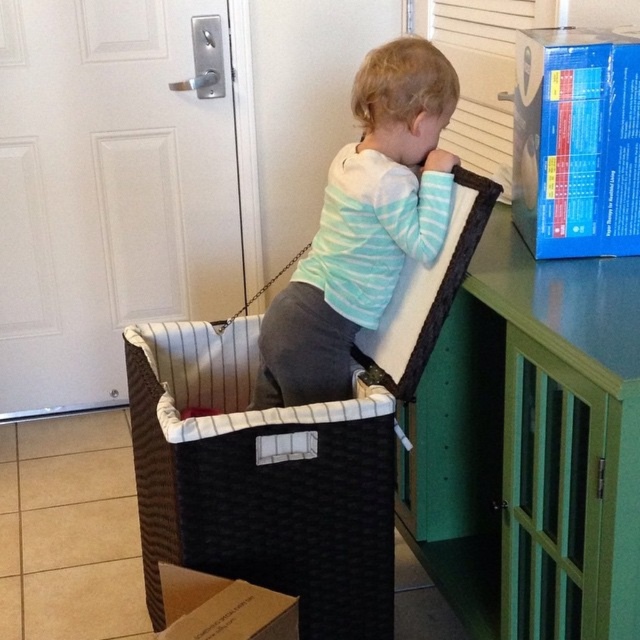
Does blue cardboard box at upper right have a greater height compared to cardboard at lower left?

Indeed, blue cardboard box at upper right has a greater height compared to cardboard at lower left.

This screenshot has width=640, height=640. I want to click on blue cardboard box at upper right, so click(x=577, y=141).

From the picture: Who is more distant from viewer, (604, 180) or (291, 612)?

The point (604, 180) is more distant.

Locate an element on the screen. blue cardboard box at upper right is located at coordinates (577, 141).

Find the location of a particular element. The image size is (640, 640). light blue striped shirt at upper center is located at coordinates click(x=364, y=225).

Can you confirm if light blue striped shirt at upper center is shorter than blue cardboard box at upper right?

No, light blue striped shirt at upper center is not shorter than blue cardboard box at upper right.

Locate an element on the screen. light blue striped shirt at upper center is located at coordinates (364, 225).

Between black woven basket at center and blue cardboard box at upper right, which one appears on the right side from the viewer's perspective?

From the viewer's perspective, blue cardboard box at upper right appears more on the right side.

Is black woven basket at center to the right of blue cardboard box at upper right from the viewer's perspective?

Incorrect, black woven basket at center is not on the right side of blue cardboard box at upper right.

Is point (172, 328) positioned behind point (625, 44)?

Yes, it is behind point (625, 44).

Identify the location of black woven basket at center. The width and height of the screenshot is (640, 640). 285,451.